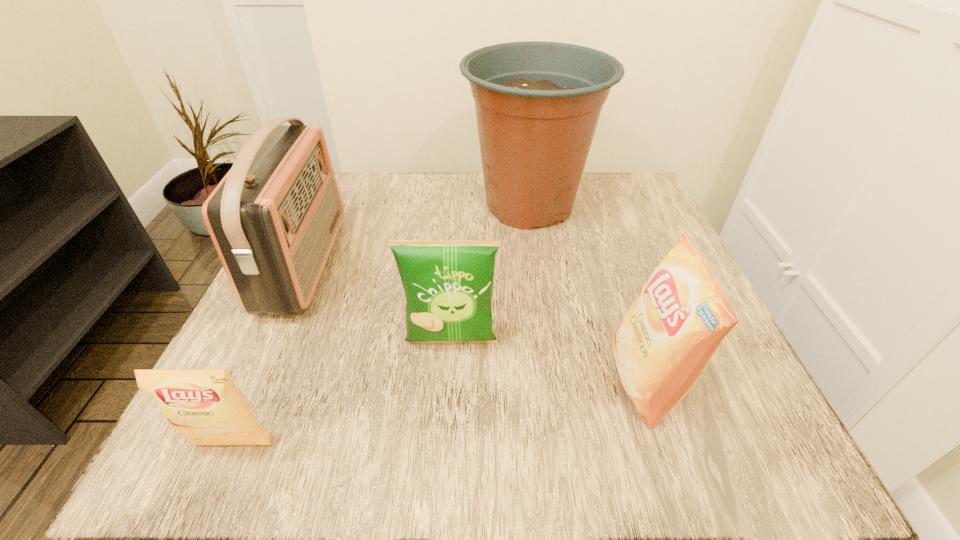
This screenshot has height=540, width=960. I want to click on object positioned at the far right corner, so click(537, 104).

Identify the location of object located in the near right corner section of the desktop. (664, 342).

Identify the location of vacant area at the far edge of the desktop. The image size is (960, 540). (382, 218).

Identify the location of free location at the left edge. The height and width of the screenshot is (540, 960). (342, 273).

Locate an element on the screen. The image size is (960, 540). free space at the right edge of the desktop is located at coordinates (620, 301).

You are a GUI agent. You are given a task and a screenshot of the screen. Output one action in this format:
    pyautogui.click(x=<x>, y=<y>)
    Task: Click on the vacant area at the far left corner
    The image size is (960, 540).
    Given the screenshot: What is the action you would take?
    pyautogui.click(x=350, y=194)

Identify the location of free space at the far right corner of the desktop. (629, 186).

The height and width of the screenshot is (540, 960). I want to click on vacant space at the near right corner of the desktop, so click(x=662, y=456).

Image resolution: width=960 pixels, height=540 pixels. What are the coordinates of `vacant region between the flowerpot and the second tallest object` in the screenshot? It's located at (417, 234).

The height and width of the screenshot is (540, 960). What are the coordinates of `empty space between the second crisp (potato chip) from left to right and the second tallest object` in the screenshot? It's located at (377, 303).